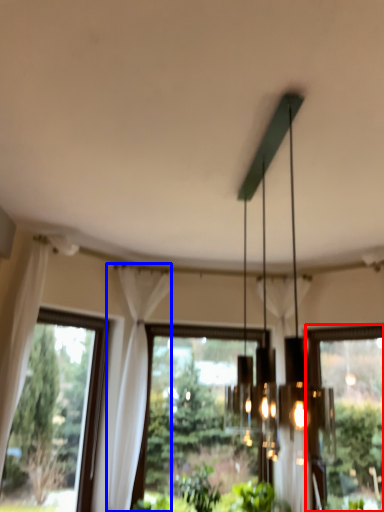
Question: Among these objects, which one is nearest to the camera, window (highlighted by a red box) or curtain (highlighted by a blue box)?

Choices:
 (A) window
 (B) curtain

Answer: (B)